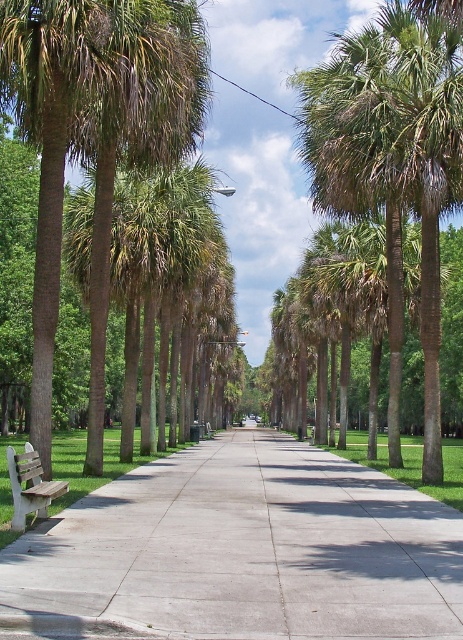
Question: Which point is farther from the camera taking this photo?

Choices:
 (A) (338, 60)
 (B) (32, 449)

Answer: (A)

Question: Which object appears closest to the camera in this image?

Choices:
 (A) wooden bench at lower left
 (B) green leafy palm tree at center
 (C) white concrete pavement at lower left

Answer: (C)

Question: Among these points, which one is farthest from the camera?

Choices:
 (A) (49, 483)
 (B) (439, 131)
 (C) (55, 556)

Answer: (B)

Question: Does green leafy palm tree at center have a greater width compared to wooden bench at lower left?

Choices:
 (A) no
 (B) yes

Answer: (B)

Question: Can you confirm if white concrete pavement at lower left is smaller than green leafy palm tree at center?

Choices:
 (A) no
 (B) yes

Answer: (B)

Question: Is green leafy palm tree at center above wooden bench at lower left?

Choices:
 (A) yes
 (B) no

Answer: (A)